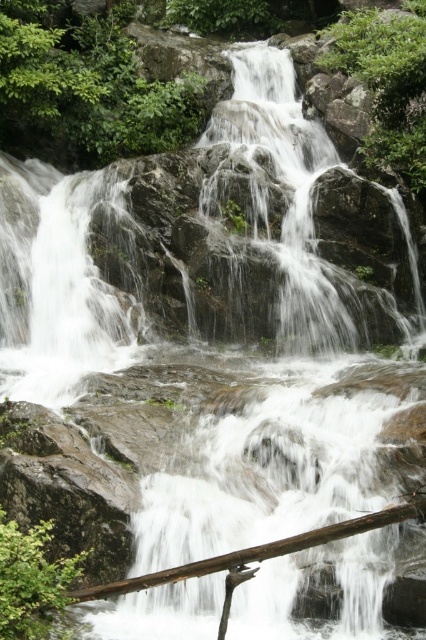
Can you confirm if white smooth waterfall at left is bigger than brown wood log at lower center?

Incorrect, white smooth waterfall at left is not larger than brown wood log at lower center.

Is point (60, 372) positioned before point (91, 593)?

No.

Is point (92, 323) farther from viewer compared to point (264, 547)?

Yes, point (92, 323) is farther from viewer.

This screenshot has width=426, height=640. In order to click on white smooth waterfall at left in this screenshot , I will do `click(57, 282)`.